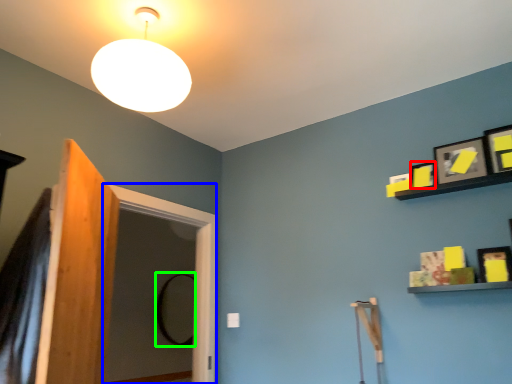
Question: Considering the real-world distances, which object is farthest from picture frame (highlighted by a red box)? screen door (highlighted by a blue box) or mirror (highlighted by a green box)?

Choices:
 (A) screen door
 (B) mirror

Answer: (B)